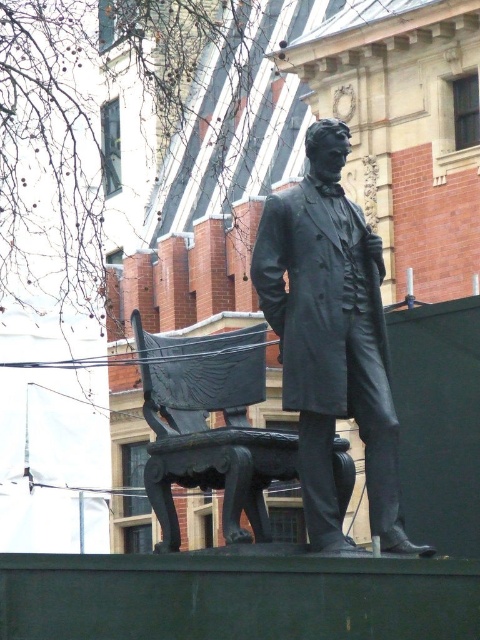
This screenshot has height=640, width=480. Find the location of `matte black statue at center`. matte black statue at center is located at coordinates (331, 339).

Identify the location of matte black statue at center. (331, 339).

You are a GUI agent. You are given a task and a screenshot of the screen. Output one action in this format:
    pyautogui.click(x=<x>, y=<y>)
    Task: Click on the matte black statue at center
    The width and height of the screenshot is (480, 640).
    Given the screenshot: What is the action you would take?
    pyautogui.click(x=331, y=339)